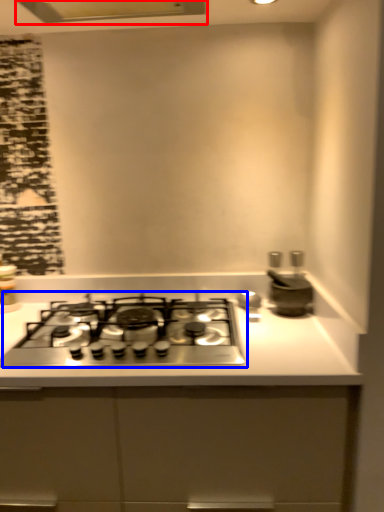
Question: Which point is closer to the camera, exhaust hood (highlighted by a red box) or gas stove (highlighted by a blue box)?

Choices:
 (A) exhaust hood
 (B) gas stove

Answer: (B)